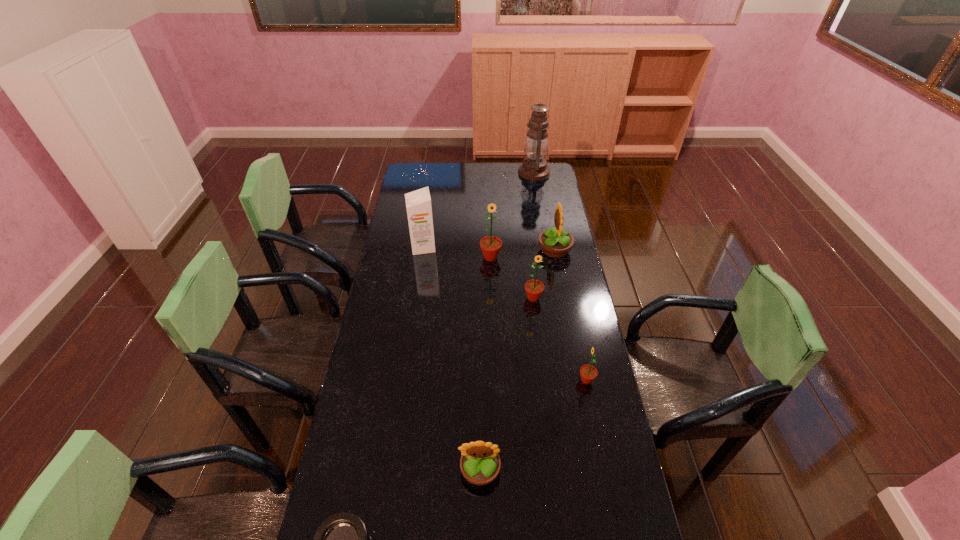
You are a GUI agent. You are given a task and a screenshot of the screen. Output one action in this format:
    pyautogui.click(x=<x>, y=<y>)
    Task: Click on the sunflower that is the fourth closest to the farthest object
    This screenshot has height=540, width=960.
    Given the screenshot: What is the action you would take?
    pyautogui.click(x=588, y=373)

I want to click on sunflower that stands as the fourth closest to the carton, so click(x=588, y=373).

Where is `the third closest green sunflower to the nearer yellow sunflower`? The width and height of the screenshot is (960, 540). the third closest green sunflower to the nearer yellow sunflower is located at coordinates (490, 245).

I want to click on green sunflower that is the closest to the third nearest object, so click(534, 288).